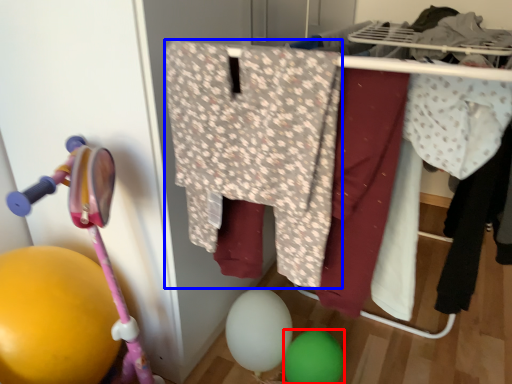
Question: Among these objects, which one is nearest to the camera, balloon (highlighted by a red box) or clothing (highlighted by a blue box)?

Choices:
 (A) balloon
 (B) clothing

Answer: (B)